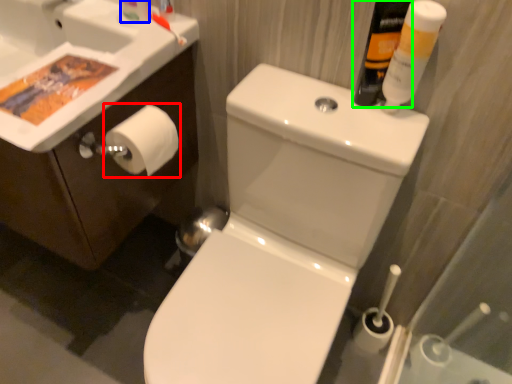
Question: Based on their relative distances, which object is farther from toilet paper (highlighted by a red box)? Choose from toiletry (highlighted by a blue box) and mouthwash (highlighted by a green box).

Choices:
 (A) toiletry
 (B) mouthwash

Answer: (B)